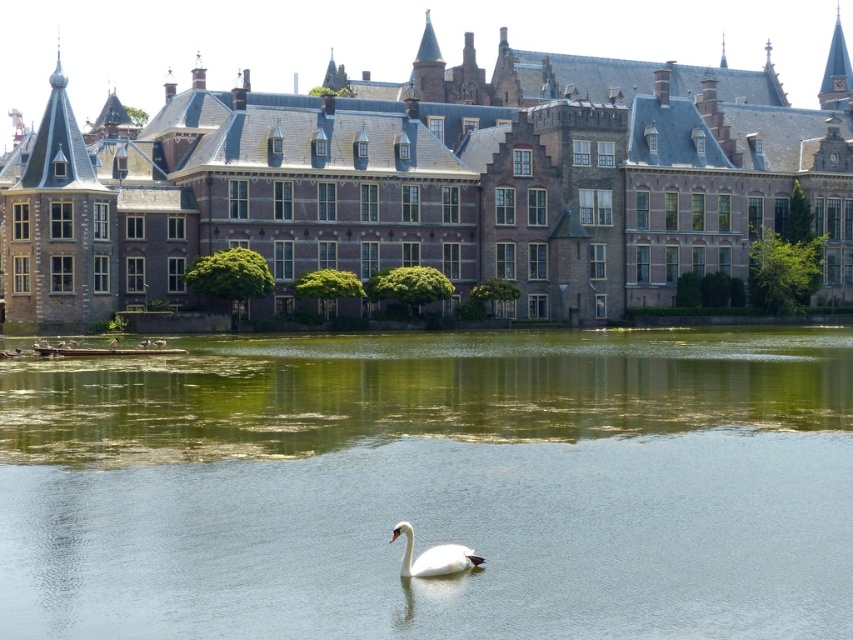
Question: Can you confirm if brown brick building at center is positioned above white glossy swan at center?

Choices:
 (A) yes
 (B) no

Answer: (A)

Question: Does brown brick building at center have a larger size compared to white glossy swan at center?

Choices:
 (A) yes
 (B) no

Answer: (A)

Question: Is brown brick building at center above white glossy swan at center?

Choices:
 (A) no
 (B) yes

Answer: (B)

Question: Which object appears farthest from the camera in this image?

Choices:
 (A) clear water at center
 (B) brown brick building at center
 (C) white glossy swan at center

Answer: (B)

Question: Estimate the real-world distances between objects in this image. Which object is closer to the white glossy swan at center?

Choices:
 (A) clear water at center
 (B) brown brick building at center

Answer: (A)

Question: Which point is farther to the camera?

Choices:
 (A) clear water at center
 (B) brown brick building at center

Answer: (B)